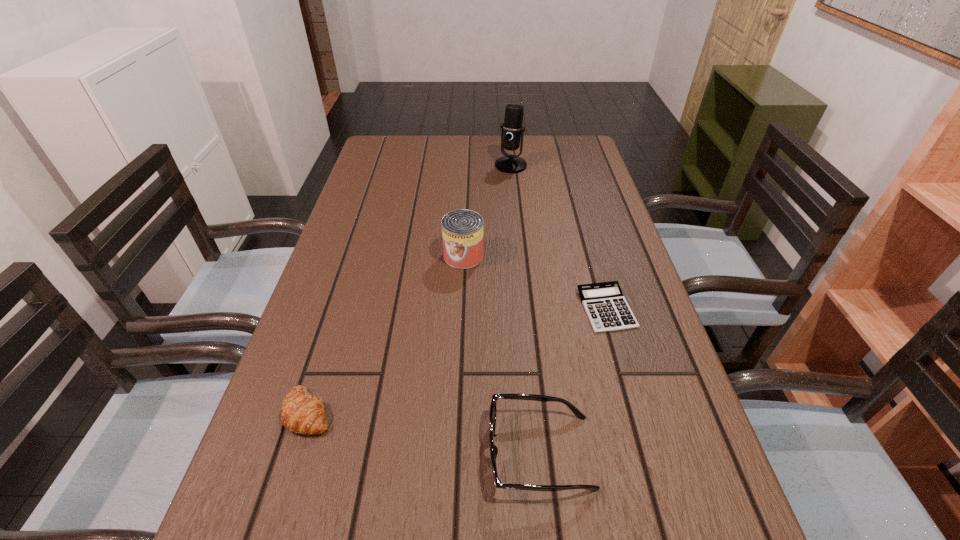
This screenshot has height=540, width=960. In order to click on the tallest object in this screenshot , I will do `click(512, 131)`.

You are a GUI agent. You are given a task and a screenshot of the screen. Output one action in this format:
    pyautogui.click(x=<x>, y=<y>)
    Task: Click on the farthest object
    The image size is (960, 540).
    Given the screenshot: What is the action you would take?
    pyautogui.click(x=512, y=131)

Image resolution: width=960 pixels, height=540 pixels. Identify the location of the second farthest object. (462, 230).

Where is `the fourth shortest object`? The image size is (960, 540). the fourth shortest object is located at coordinates (462, 230).

Identify the location of the third shortest object. (493, 408).

The image size is (960, 540). Find the location of `crescent roll`. crescent roll is located at coordinates (302, 413).

At what (x,y) coordinates should I click in order to perform the action: click on the fourth tallest object. Please return your answer as a coordinate pair (x, y). The height and width of the screenshot is (540, 960). Looking at the image, I should click on (302, 413).

Identify the location of calculator. (607, 309).

Identify the location of the shortest object. (607, 309).

Find the location of `vacant area situated on the left of the microphone`. vacant area situated on the left of the microphone is located at coordinates (381, 165).